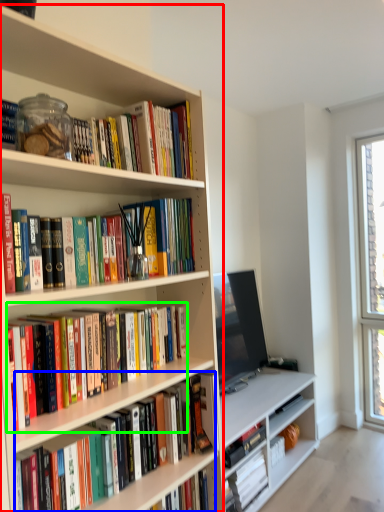
Question: Based on their relative distances, which object is nearer to bookcase (highlighted by a red box)? Choose from book (highlighted by a blue box) and book (highlighted by a green box).

Choices:
 (A) book
 (B) book

Answer: (B)